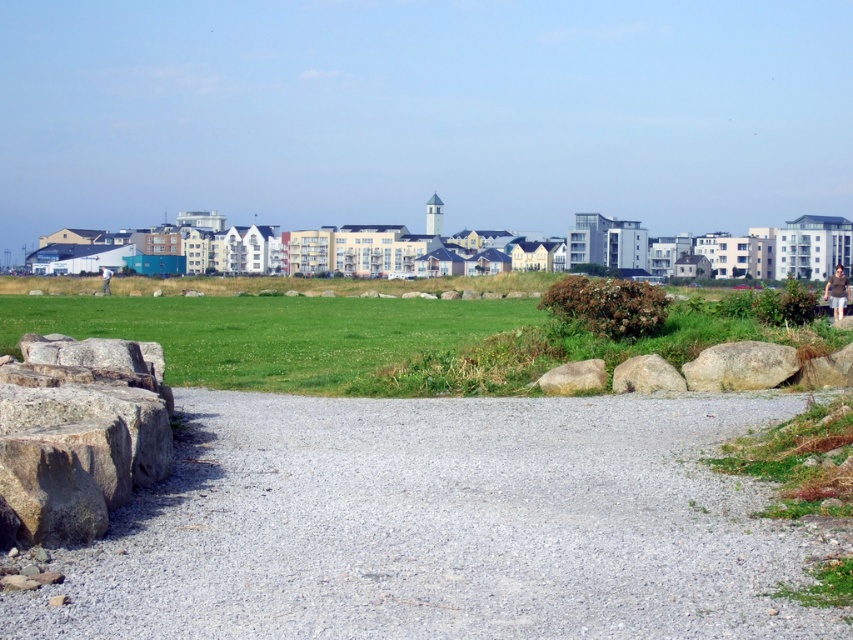
Measure the distance between green grass at lower center and camera.

green grass at lower center is 70.78 feet from camera.

Is point (685, 356) more distant than point (593, 372)?

Yes, point (685, 356) is farther from viewer.

Which is behind, point (312, 320) or point (583, 381)?

The point (312, 320) is more distant.

You are a GUI agent. You are given a task and a screenshot of the screen. Output one action in this format:
    pyautogui.click(x=<x>, y=<y>)
    Task: Click on the green grass at lower center
    
    Given the screenshot: What is the action you would take?
    pyautogui.click(x=373, y=339)

Between green grass at lower center and smooth gray rock at center-right, which one appears on the right side from the viewer's perspective?

Positioned to the right is smooth gray rock at center-right.

Which is in front, point (190, 298) or point (633, 376)?

Point (633, 376) is in front.

Who is more distant from viewer, (291, 378) or (680, 381)?

The point (291, 378) is behind.

Find the location of `green grass at lower center`. green grass at lower center is located at coordinates (373, 339).

From the picture: Does brown rough stone at lower left have a lesser width compared to brown rough boulder at center?

In fact, brown rough stone at lower left might be wider than brown rough boulder at center.

Measure the distance from brown rough stone at lower left to brown rough boulder at center.

brown rough stone at lower left and brown rough boulder at center are 6.64 meters apart.

Which is behind, point (54, 426) or point (589, 381)?

Point (589, 381)

Find the location of a particular element. The height and width of the screenshot is (640, 853). brown rough stone at lower left is located at coordinates (80, 433).